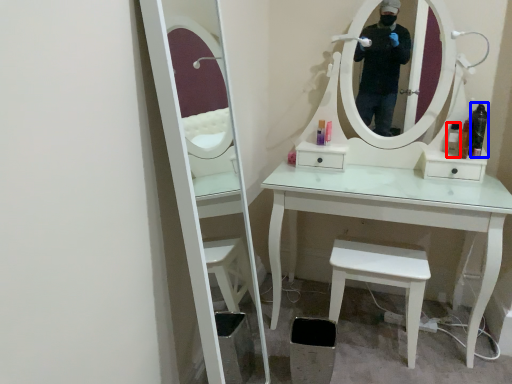
Question: Which object is further to the camera taking this photo, toiletry (highlighted by a red box) or toiletry (highlighted by a blue box)?

Choices:
 (A) toiletry
 (B) toiletry

Answer: (A)